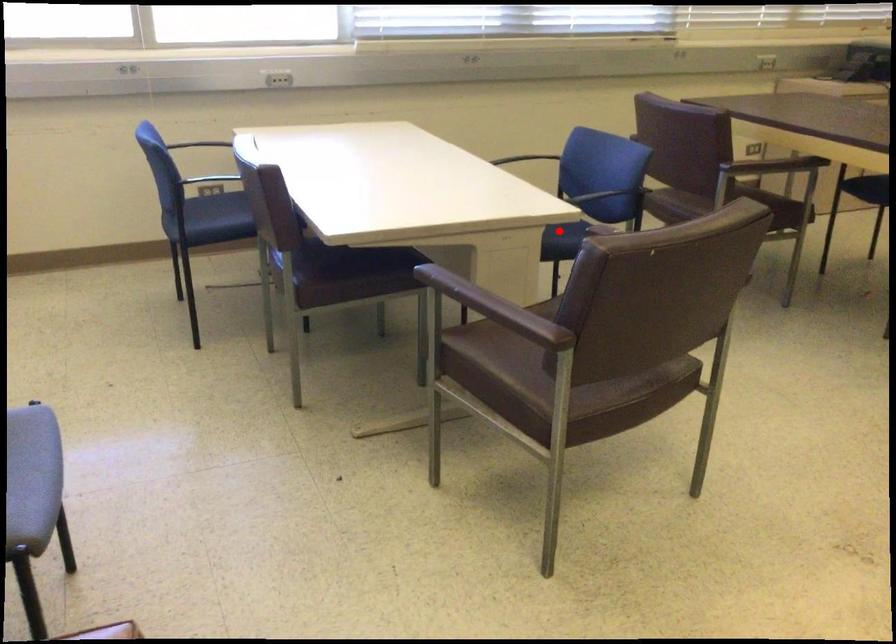
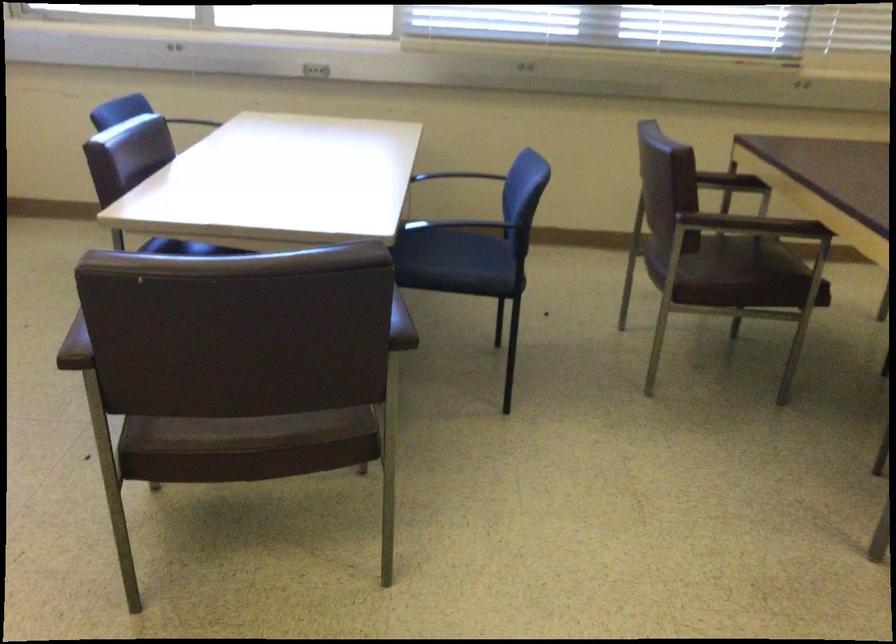
Question: I am providing you with two images of the same scene from different viewpoints. Given a red point in image1, look at the same physical point in image2. Is it:

Choices:
 (A) Closer to the viewpoint
 (B) Farther from the viewpoint

Answer: (A)